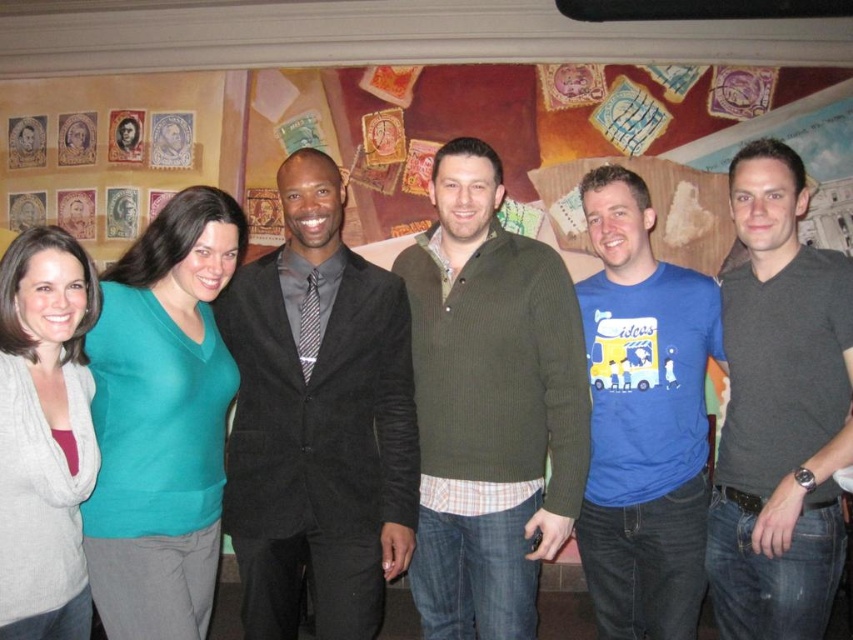
You are organizing a photo shoot and need to ensure that the two central figures in the image are positioned so that their outfits do not overlap. Given that the suede black suit at center is wider than the dark gray shirt at center, which outfit should be moved to the side to prevent overlap?

The suede black suit at center should be moved to the side because it is wider than the dark gray shirt at center, reducing the chance of overlap.

You are a photographer trying to adjust the positions of the two central individuals in the group photo. The goal is to ensure that the suede black suit at center and the dark gray shirt at center are aligned symmetrically along the horizontal axis. Given their current positions, which adjustment would you make?

Since the suede black suit at center is to the left of the dark gray shirt at center, you should move the suede black suit at center further to the right and the dark gray shirt at center further to the left until they are mirrored around the central axis.